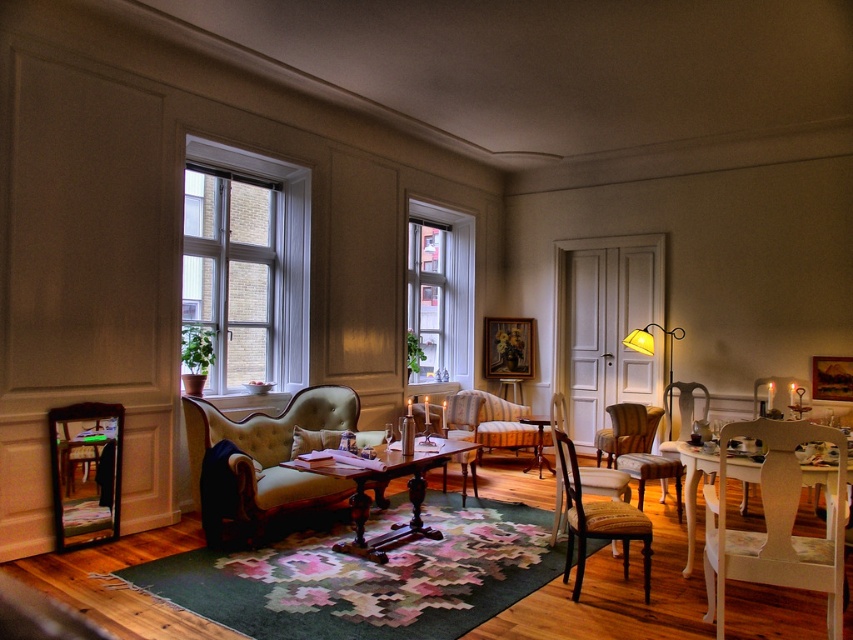
Is point (229, 424) farther from camera compared to point (676, 388)?

No, (229, 424) is in front of (676, 388).

Is point (294, 483) farther from viewer compared to point (666, 444)?

No, (294, 483) is in front of (666, 444).

Where is `tufted leather couch at center`? The width and height of the screenshot is (853, 640). tufted leather couch at center is located at coordinates (262, 458).

Is white wooden window at left thinner than white wood chair at lower right?

No.

What are the coordinates of `white wooden window at left` in the screenshot? It's located at (247, 264).

Is white wooden window at left smaller than wooden chair at center?

Actually, white wooden window at left might be larger than wooden chair at center.

Does white wooden window at left have a lesser height compared to wooden chair at center?

No, white wooden window at left is not shorter than wooden chair at center.

Which is behind, point (198, 148) or point (663, 497)?

The point (663, 497) is more distant.

Where is `white wooden window at left`? white wooden window at left is located at coordinates (247, 264).